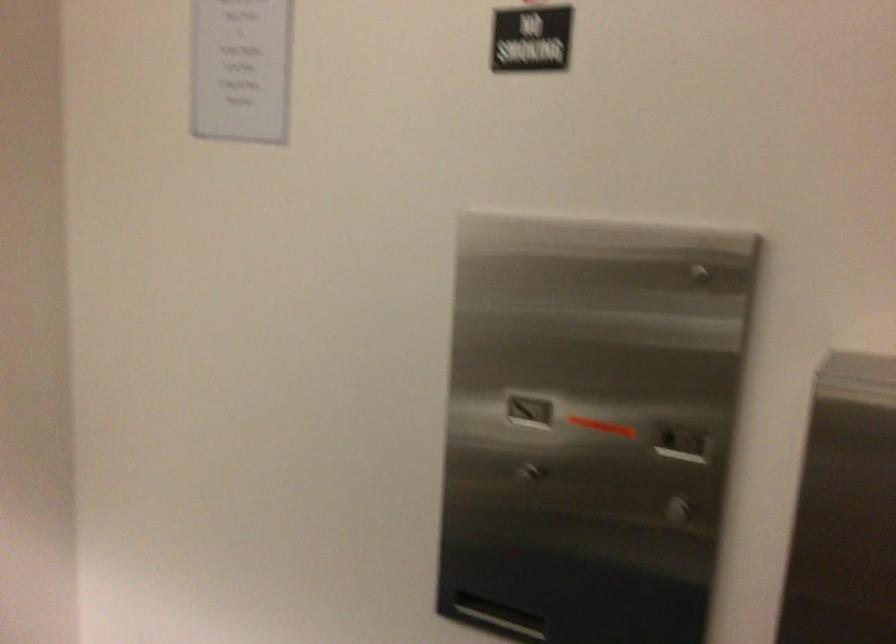
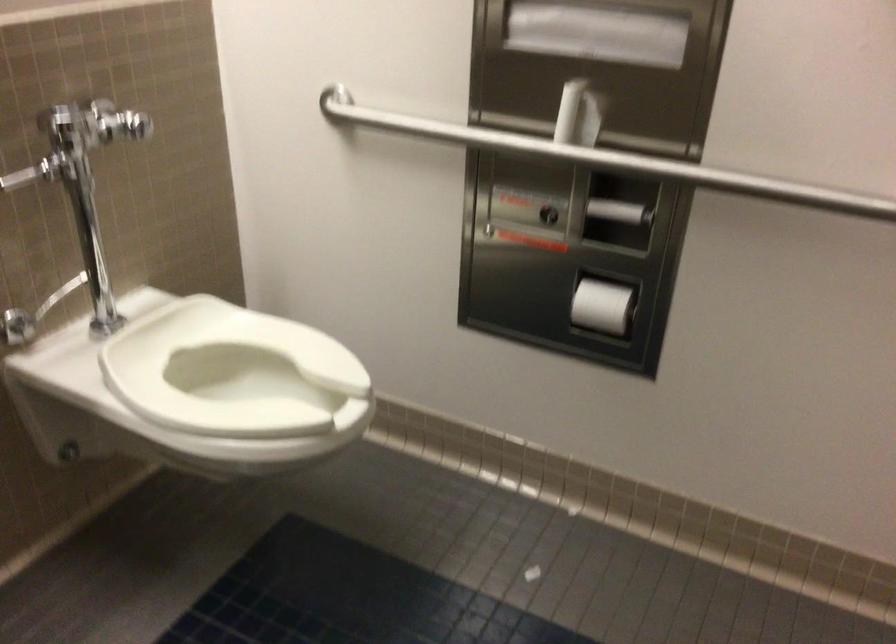
From the picture: Based on the continuous images, in which direction is the camera rotating?

The camera rotated toward left-down.